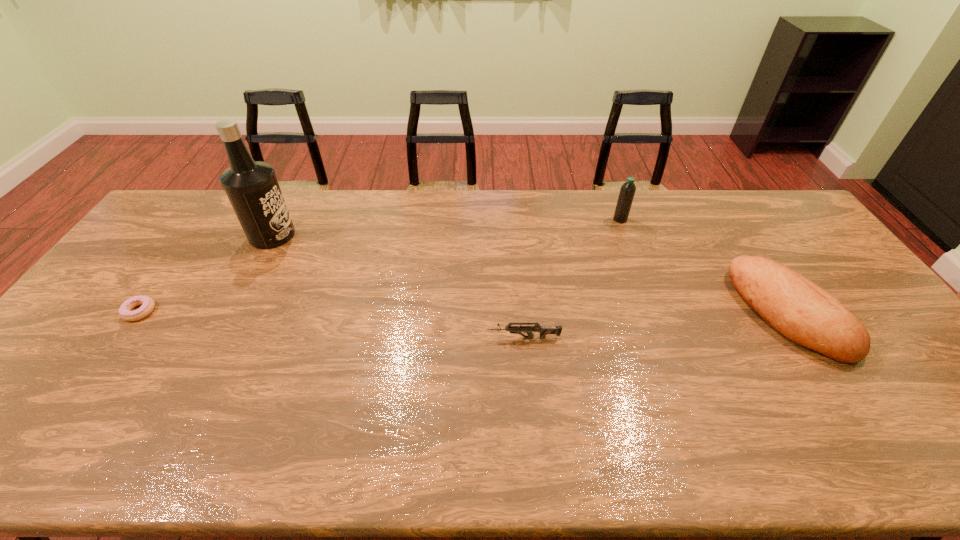
You are a GUI agent. You are given a task and a screenshot of the screen. Output one action in this format:
    pyautogui.click(x=<x>, y=<y>)
    Task: Click on the unoccupied area between the doughnut and the third object from right to left
    The image size is (960, 540).
    Given the screenshot: What is the action you would take?
    pyautogui.click(x=332, y=325)

Identify the location of vacant area that lies between the rightmost object and the gun. (656, 325).

Where is `free space that is in between the third tallest object and the third object from right to left`? free space that is in between the third tallest object and the third object from right to left is located at coordinates (656, 325).

You are a GUI agent. You are given a task and a screenshot of the screen. Output one action in this format:
    pyautogui.click(x=<x>, y=<y>)
    Task: Click on the blank region between the doughnut and the third tallest object
    Image resolution: width=960 pixels, height=540 pixels.
    Given the screenshot: What is the action you would take?
    pyautogui.click(x=464, y=312)

Where is `free area in between the liquor and the second object from right to left`? Image resolution: width=960 pixels, height=540 pixels. free area in between the liquor and the second object from right to left is located at coordinates (446, 227).

The width and height of the screenshot is (960, 540). In order to click on free space between the tallest object and the water bottle in this screenshot , I will do `click(446, 227)`.

Where is `object that is the third closest to the fourth tallest object`? The height and width of the screenshot is (540, 960). object that is the third closest to the fourth tallest object is located at coordinates (252, 188).

Locate which object ranks fourth in proximity to the doughnut. Please provide its 2D coordinates. Your answer should be formatted as a tuple, i.e. [(x, y)], where the tuple contains the x and y coordinates of a point satisfying the conditions above.

[(797, 308)]